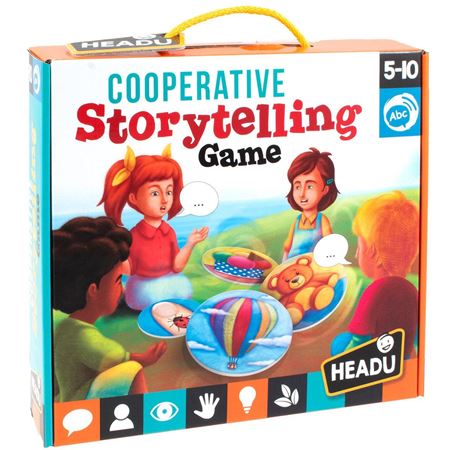
You are a GUI agent. You are given a task and a screenshot of the screen. Output one action in this format:
    pyautogui.click(x=<x>, y=<y>)
    Task: Click on the box
    The width and height of the screenshot is (450, 450).
    Given the screenshot: What is the action you would take?
    pyautogui.click(x=335, y=104)